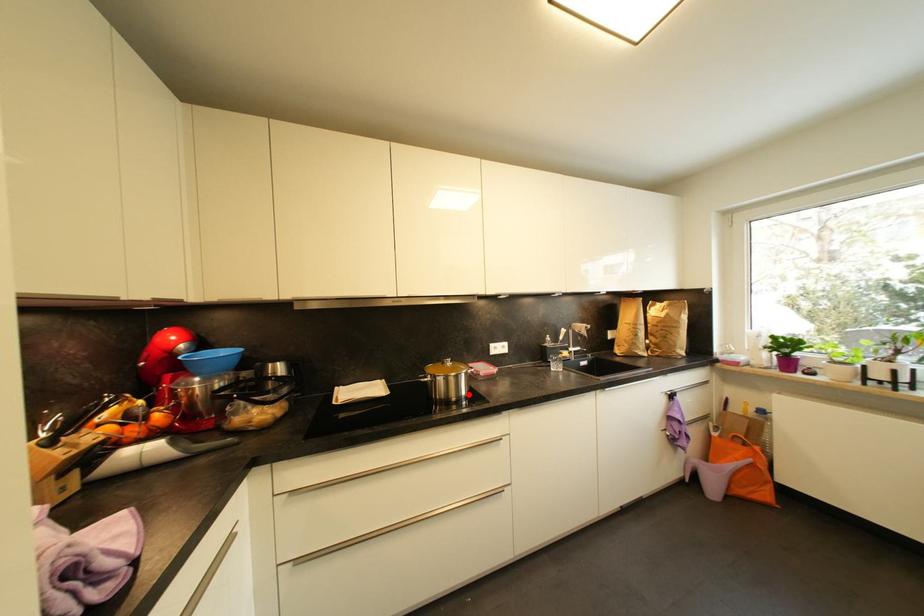
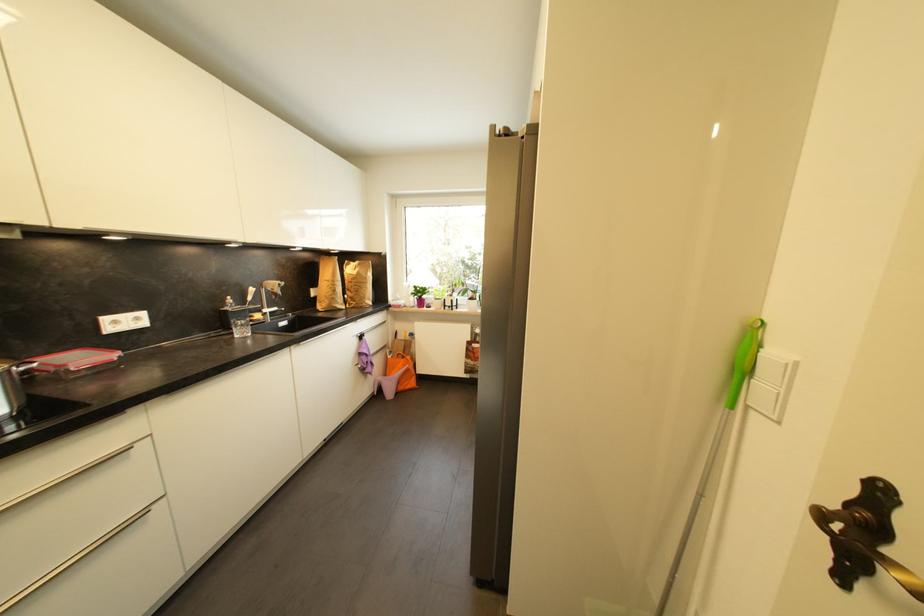
Locate, in the second image, the point that corresponds to the highlighted location in the first image.

(8, 411)